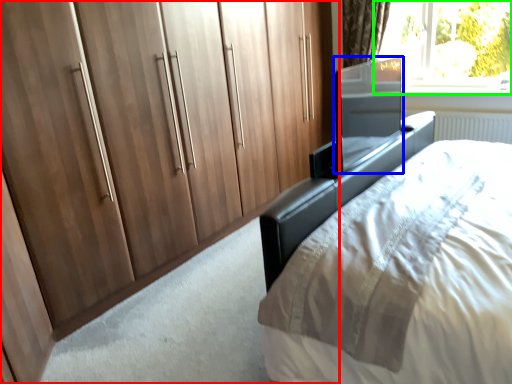
Question: Estimate the real-world distances between objects in this image. Which object is farther from cupboard (highlighted by a red box), screen door (highlighted by a blue box) or window (highlighted by a green box)?

Choices:
 (A) screen door
 (B) window

Answer: (B)